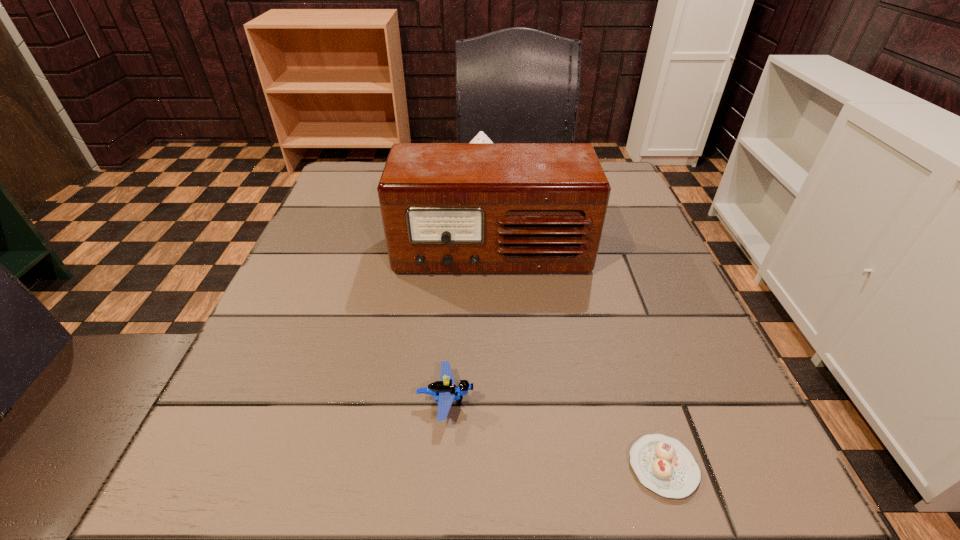
I want to click on the third nearest object, so click(x=447, y=208).

Image resolution: width=960 pixels, height=540 pixels. In order to click on radio receiver in this screenshot , I will do `click(447, 208)`.

Where is `the taller cupcake`? the taller cupcake is located at coordinates (480, 137).

Find the location of `the third shortest object`. the third shortest object is located at coordinates (480, 137).

Find the location of a particular element. the second shortest object is located at coordinates (445, 391).

Find the location of a particular element. The image size is (960, 540). the second nearest object is located at coordinates (445, 391).

The image size is (960, 540). I want to click on the shortest object, so click(x=664, y=465).

Locate an element on the screen. the shorter cupcake is located at coordinates (664, 465).

You are a GUI agent. You are given a task and a screenshot of the screen. Output one action in this format:
    pyautogui.click(x=<x>, y=<y>)
    Task: Click on the free location located on the front-facing side of the second farthest object
    
    Given the screenshot: What is the action you would take?
    pyautogui.click(x=494, y=330)

You are a GUI agent. You are given a task and a screenshot of the screen. Output one action in this format:
    pyautogui.click(x=<x>, y=<y>)
    Task: Click on the free space located on the left of the left cupcake
    The height and width of the screenshot is (540, 960).
    Given the screenshot: What is the action you would take?
    pyautogui.click(x=352, y=171)